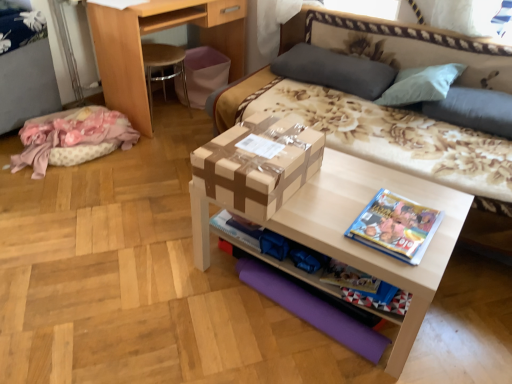
You are a GUI agent. You are given a task and a screenshot of the screen. Output one action in this format:
    pyautogui.click(x=<x>, y=<y>)
    Task: Click on the free space between blue glossy book at right and brown cardboard box at center
    The height and width of the screenshot is (384, 512).
    Given the screenshot: What is the action you would take?
    [334, 206]